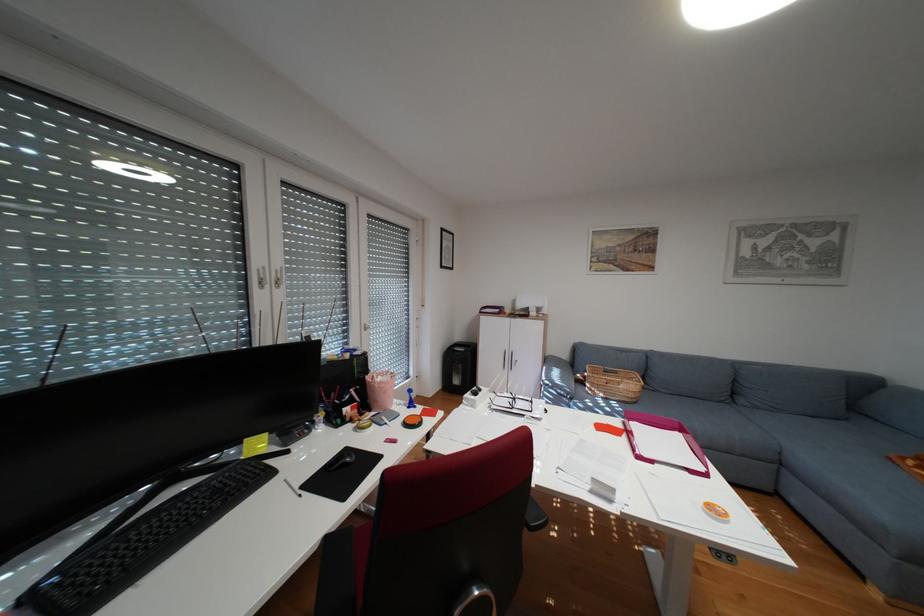
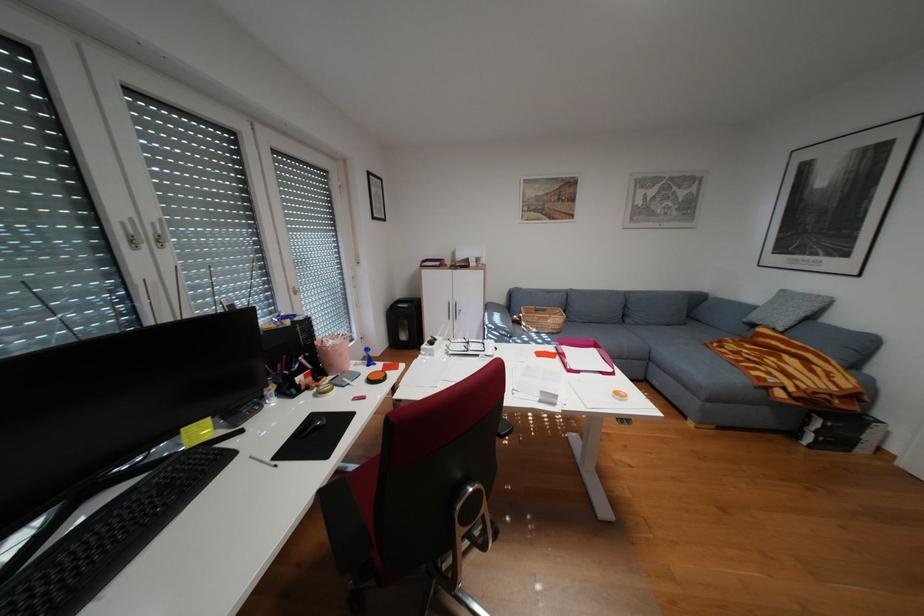
In the second image, find the point that corresponds to (x=417, y=403) in the first image.

(375, 363)